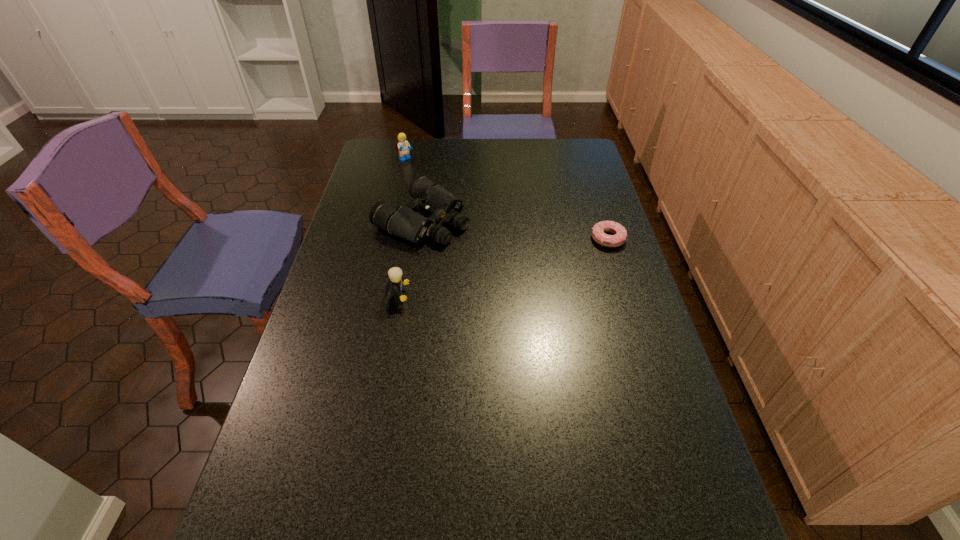
Where is `the nearest object`? This screenshot has width=960, height=540. the nearest object is located at coordinates (396, 281).

Where is `the right Lego`? This screenshot has height=540, width=960. the right Lego is located at coordinates (396, 281).

The image size is (960, 540). In order to click on doughnut in this screenshot , I will do `click(598, 231)`.

Image resolution: width=960 pixels, height=540 pixels. I want to click on the rightmost object, so click(598, 231).

The height and width of the screenshot is (540, 960). Find the location of `the farther Lego`. the farther Lego is located at coordinates pyautogui.click(x=402, y=147).

The width and height of the screenshot is (960, 540). Find the location of `the left Lego`. the left Lego is located at coordinates (402, 147).

Locate an element on the screen. This screenshot has width=960, height=540. binoculars is located at coordinates pos(444,207).

Where is `vacant space located on the front-facing side of the nearer Lego`? Image resolution: width=960 pixels, height=540 pixels. vacant space located on the front-facing side of the nearer Lego is located at coordinates (447, 298).

Identify the location of vacant space located on the back of the shortest object. (592, 190).

The image size is (960, 540). I want to click on free space located on the front-facing side of the left Lego, so click(429, 178).